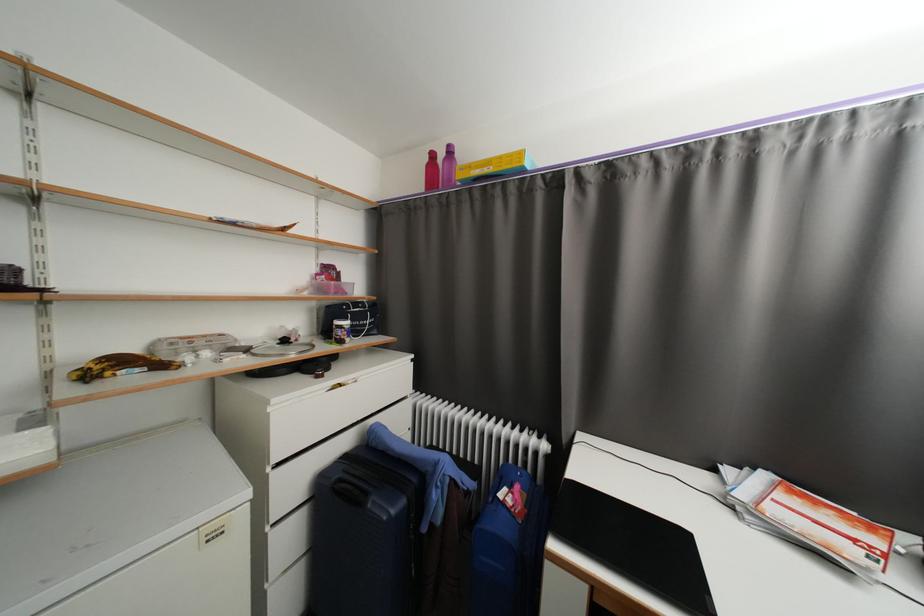
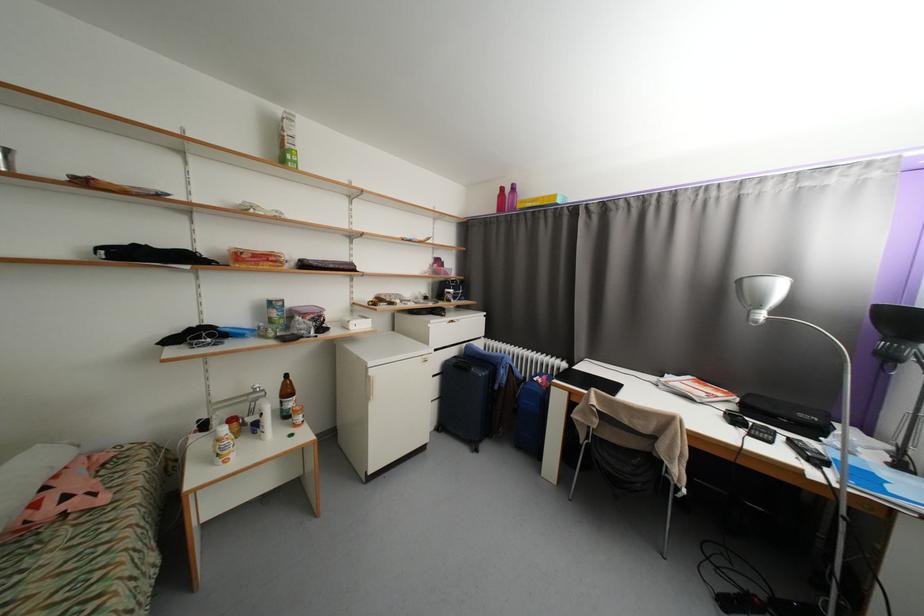
Locate, in the second image, the point that corresponds to the point at 439,156 in the first image.

(508, 190)